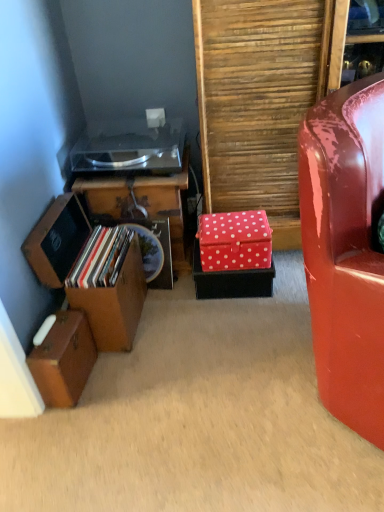
Image resolution: width=384 pixels, height=512 pixels. In order to click on blank space situated above red polka dot fabric box at center, which ranks as the 1th storage box in right-to-left order (from a real-world perspective) in this screenshot , I will do `click(234, 223)`.